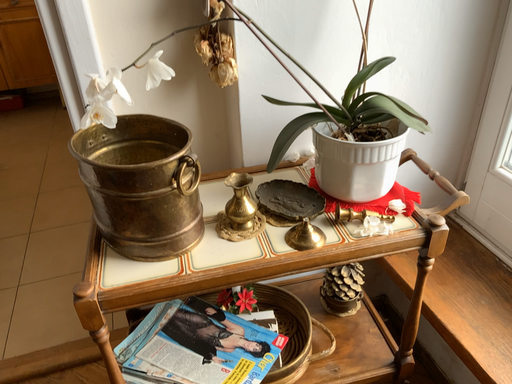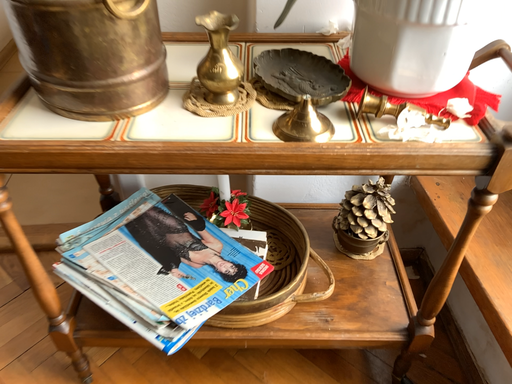
Question: Which way did the camera rotate in the video?

Choices:
 (A) rotated upward
 (B) rotated downward

Answer: (B)